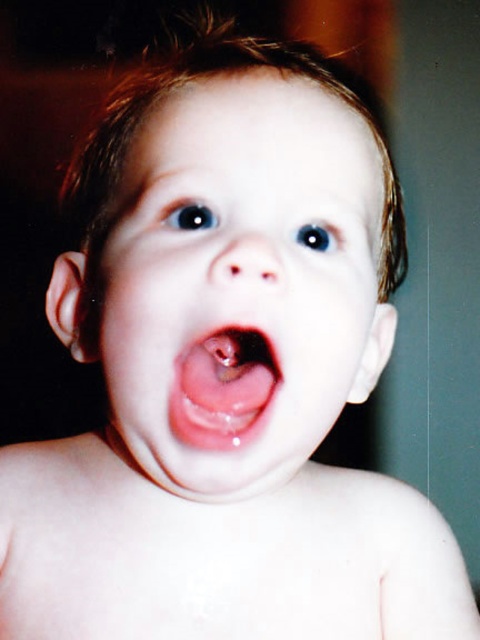
Is smooth skin face at center below pink glossy tongue at center?

Actually, smooth skin face at center is above pink glossy tongue at center.

Is point (252, 273) farther from camera compared to point (189, 356)?

No.

Measure the distance between point (177, 90) and camera.

Point (177, 90) is 13.59 inches from camera.

Find the location of a particular element. smooth skin face at center is located at coordinates (242, 282).